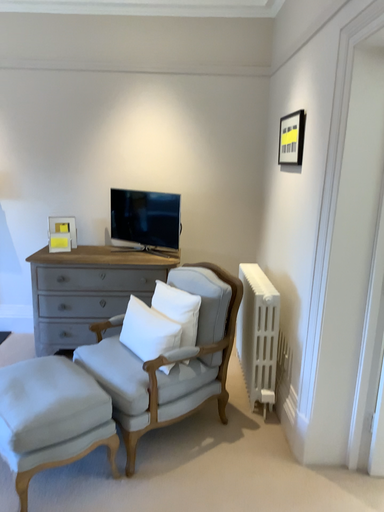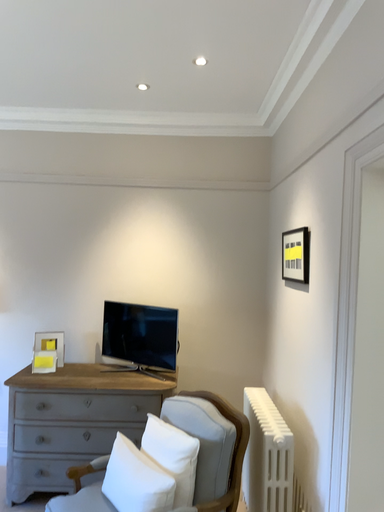
Question: Which way did the camera rotate in the video?

Choices:
 (A) rotated upward
 (B) rotated downward

Answer: (A)